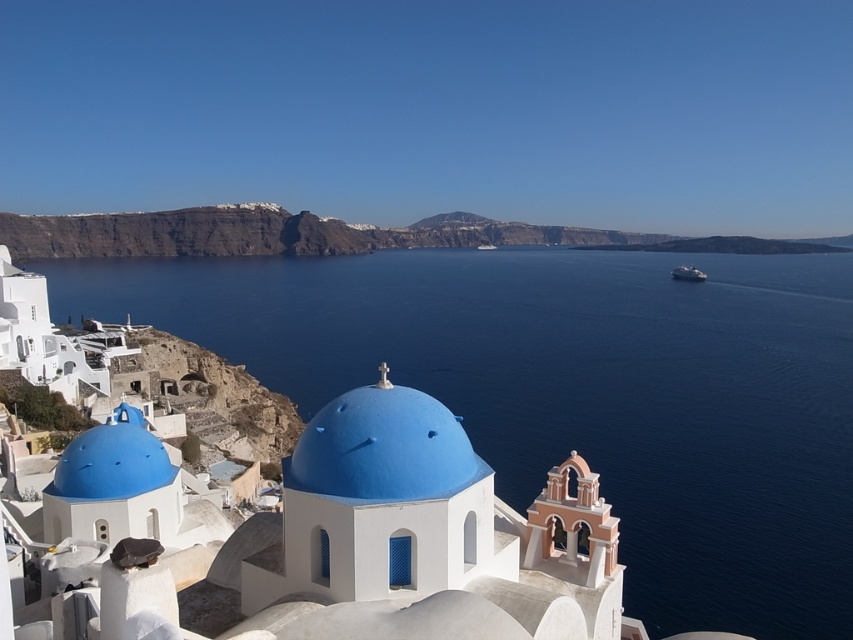
Consider the image. You are standing at the point marked as point (578,392) in the Santorini scene. What do you see directly in front of you?

At point (578,392), there is blue liquid water at center directly in front of you.

You are a tourist in Santorini and want to take a photo that includes both the blue liquid water at center and the blue matte dome at center. Which object should you position closer to the edge of your camera frame to ensure both fit in the shot?

The blue liquid water at center might be wider than blue matte dome at center, so you should position the blue liquid water at center closer to the edge of your camera frame to ensure both fit in the shot.